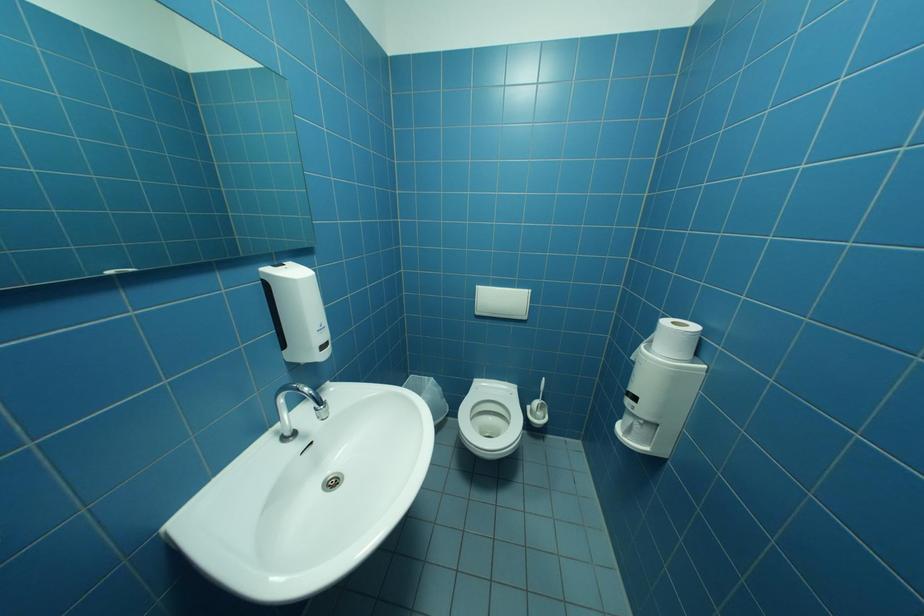
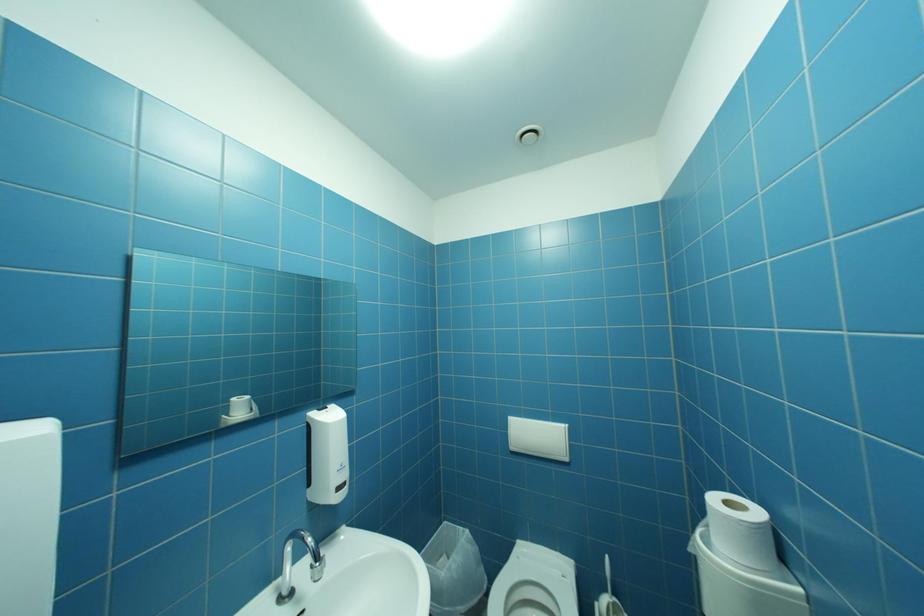
In a continuous first-person perspective shot, in which direction is the camera moving?

The movement direction of the cameraman is right, backward.